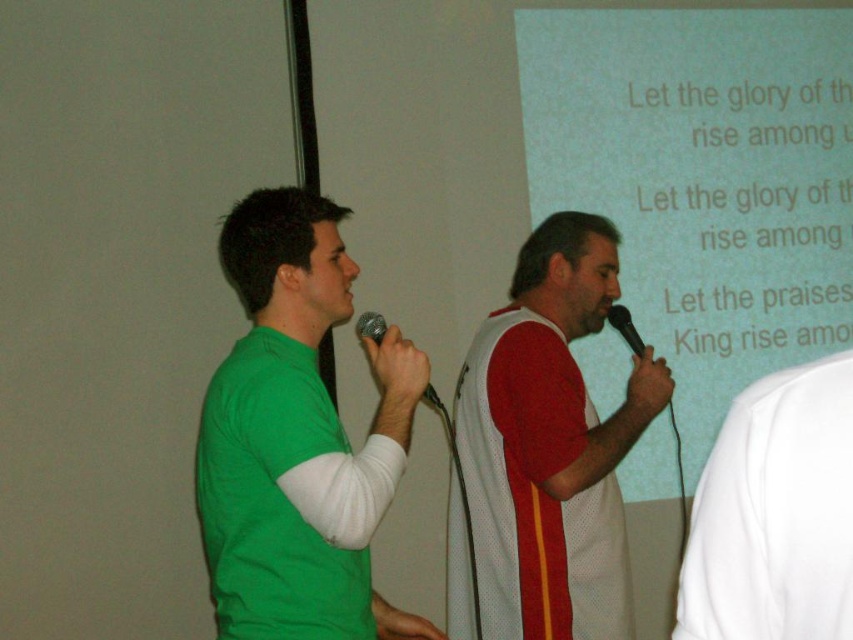
Question: Does green matte t-shirt at left appear under black matte microphone at center?

Choices:
 (A) no
 (B) yes

Answer: (B)

Question: Estimate the real-world distances between objects in this image. Which object is farther from the green matte t-shirt at left?

Choices:
 (A) white jersey with red stripes at center
 (B) metallic silver microphone at center

Answer: (A)

Question: Can you confirm if white matte projection screen at upper center is thinner than green matte t-shirt at left?

Choices:
 (A) yes
 (B) no

Answer: (B)

Question: Which object is positioned farthest from the white matte shirt at right?

Choices:
 (A) metallic silver microphone at center
 (B) white matte projection screen at upper center
 (C) black matte microphone at center
 (D) white jersey with red stripes at center

Answer: (B)

Question: Does green matte t-shirt at left have a greater width compared to black matte microphone at center?

Choices:
 (A) yes
 (B) no

Answer: (A)

Question: Which of these objects is positioned farthest from the metallic silver microphone at center?

Choices:
 (A) white matte shirt at right
 (B) white jersey with red stripes at center

Answer: (A)